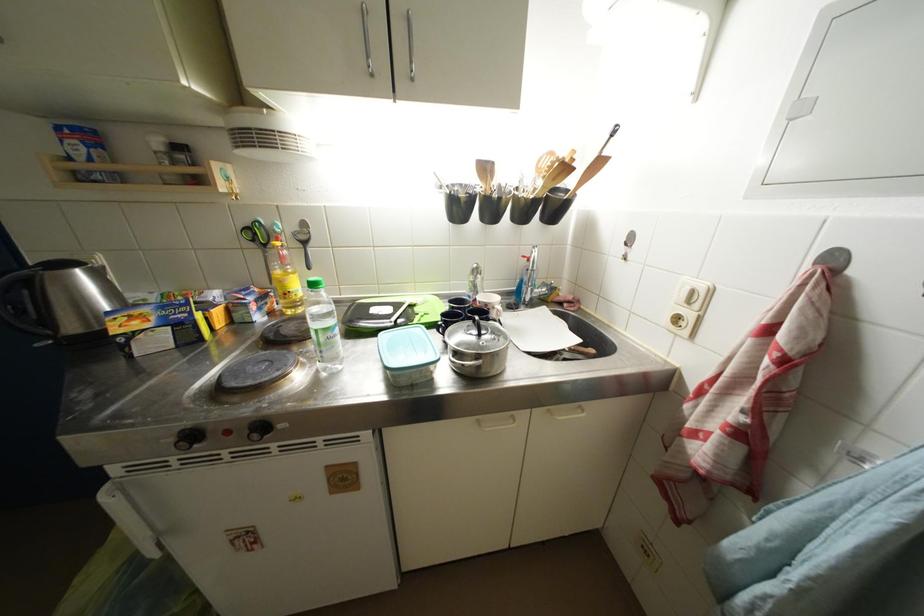
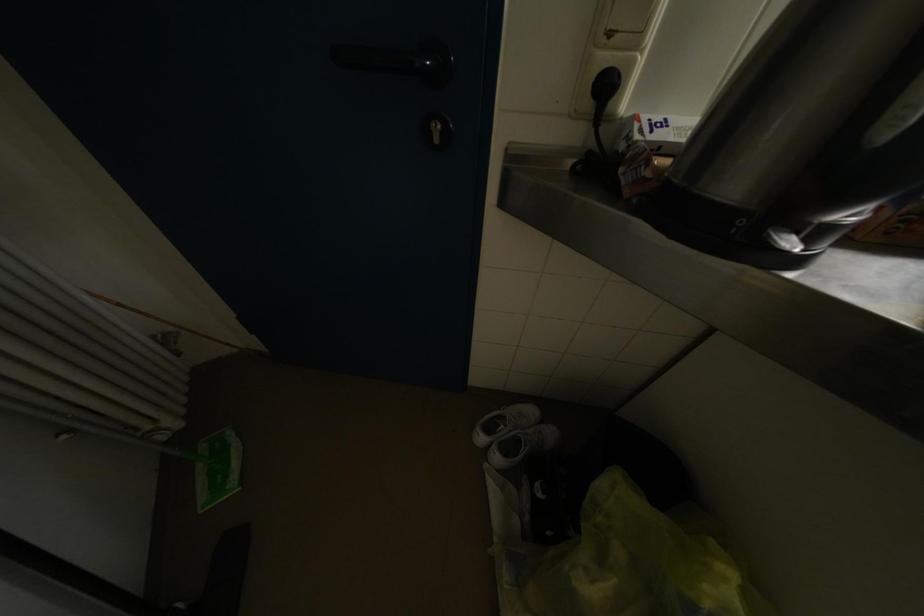
Question: The images are taken continuously from a first-person perspective. In which direction are you moving?

Choices:
 (A) Left
 (B) Right
 (C) Forward
 (D) Backward

Answer: (A)